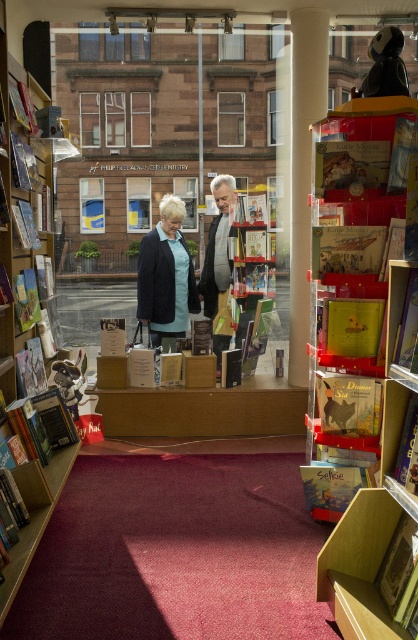
Can you confirm if matte plastic bookshelf at right is shorter than matte black jacket at center?

No, matte plastic bookshelf at right is not shorter than matte black jacket at center.

Can you confirm if matte plastic bookshelf at right is positioned above matte black jacket at center?

No.

Who is more distant from viewer, (323, 205) or (170, 314)?

The point (170, 314) is behind.

This screenshot has width=418, height=640. I want to click on matte plastic bookshelf at right, so click(x=359, y=419).

Is matte black jacket at center wider than hardcover book at center?

Correct, the width of matte black jacket at center exceeds that of hardcover book at center.

Does matte black jacket at center appear over hardcover book at center?

Correct, matte black jacket at center is located above hardcover book at center.

Is point (188, 272) more distant than point (359, 305)?

Yes, it is.

At what (x,y) coordinates should I click in order to perform the action: click on matte black jacket at center. Please return your answer as a coordinate pair (x, y). Looking at the image, I should click on (165, 275).

Who is shorter, wooden bookshelf at left or matte black jacket at center?

matte black jacket at center is shorter.

Who is more distant from viewer, [33,474] or [165,321]?

The point [165,321] is more distant.

Is point (28, 84) closer to camera compared to point (175, 324)?

Yes, it is.

Where is `wooden bookshelf at left`? wooden bookshelf at left is located at coordinates (27, 328).